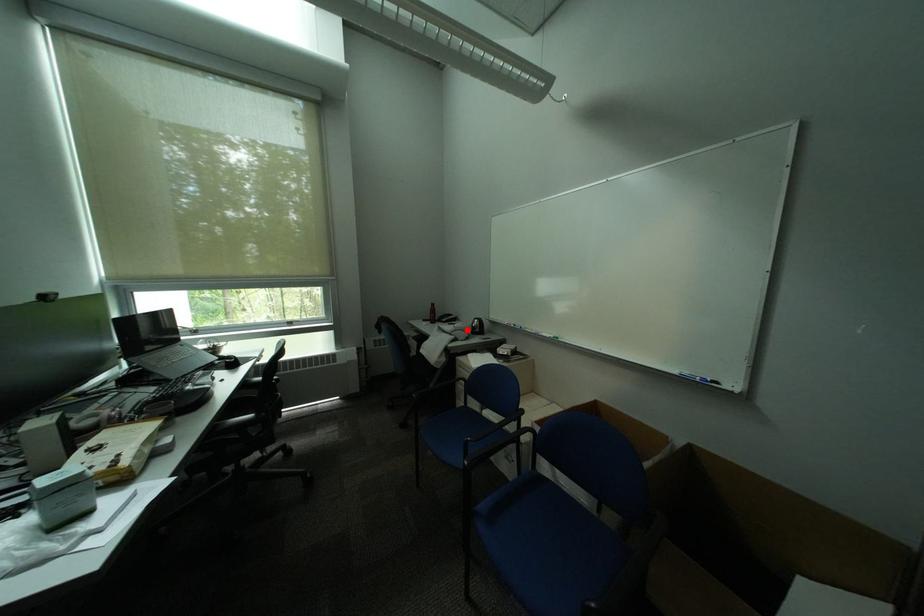
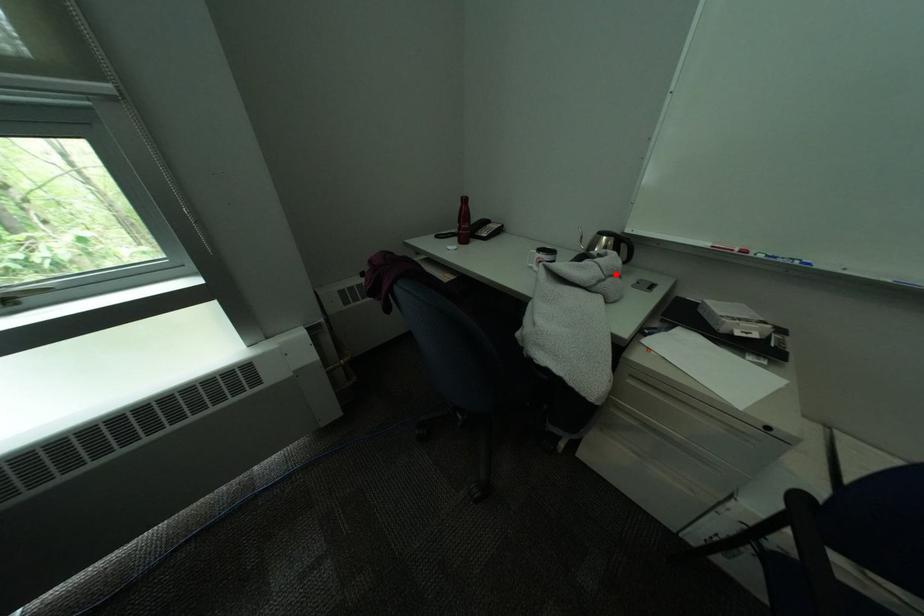
I am providing you with two images of the same scene from different viewpoints. A red point is marked on the first image and another point is marked on the second image. Are the points marked in image1 and image2 representing the same 3D position?

Yes